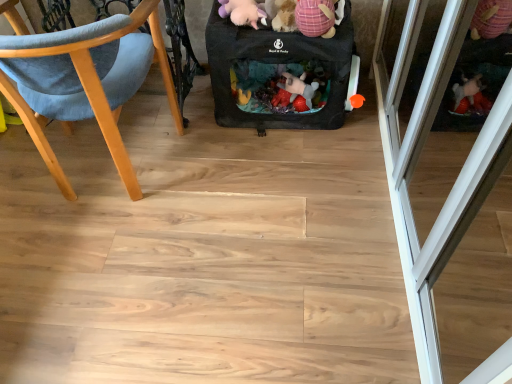
Where is `free space between wooden chair at left and transparent glass screen door at right`? This screenshot has height=384, width=512. free space between wooden chair at left and transparent glass screen door at right is located at coordinates (263, 226).